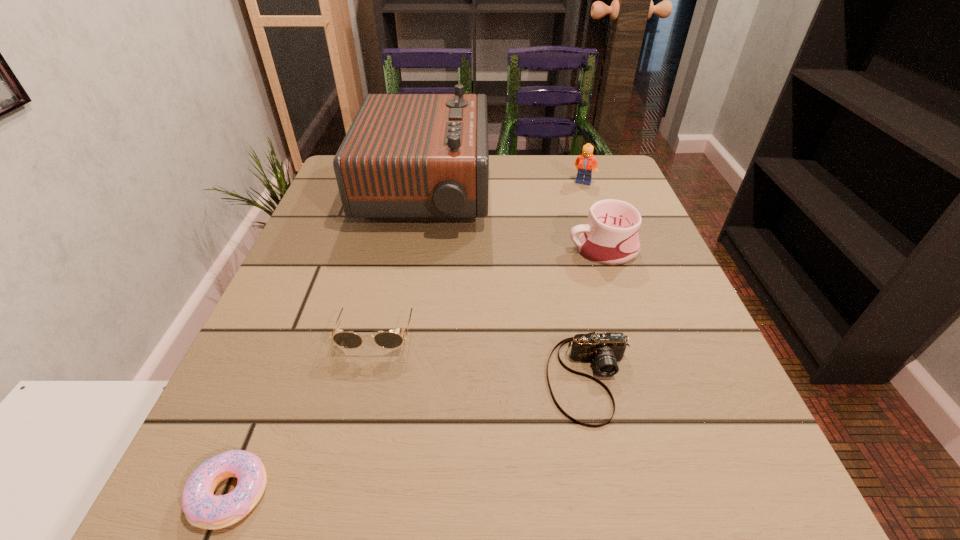
The width and height of the screenshot is (960, 540). I want to click on vacant area that lies between the fifth tallest object and the mug, so click(x=596, y=314).

You are a GUI agent. You are given a task and a screenshot of the screen. Output one action in this format:
    pyautogui.click(x=<x>, y=<y>)
    Task: Click on the object that stands as the closest to the fourth shortest object
    The image size is (960, 540).
    Given the screenshot: What is the action you would take?
    pyautogui.click(x=406, y=157)

Find the location of `object that is the fifth closest to the nearest object`. object that is the fifth closest to the nearest object is located at coordinates (586, 162).

Find the location of a particular element. The image size is (960, 540). free space that satisfies the following two spatial constraints: 1. on the front-facing side of the Lego; 2. on the side with the handle of the mug is located at coordinates (606, 249).

Find the location of a particular element. free space that satisfies the following two spatial constraints: 1. on the front-facing side of the Lego; 2. on the side with the handle of the mug is located at coordinates [606, 249].

This screenshot has height=540, width=960. I want to click on free location that satisfies the following two spatial constraints: 1. on the side with the handle of the mug; 2. on the front-facing side of the second shortest object, so click(x=645, y=379).